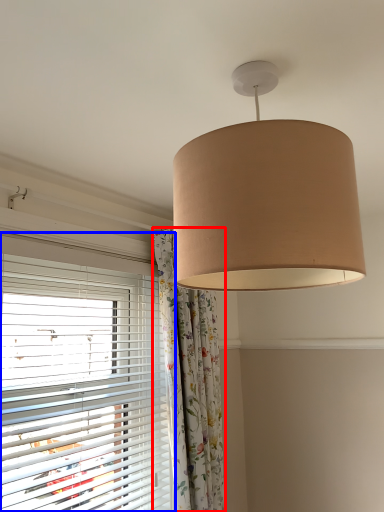
Question: Among these objects, which one is farthest to the camera, curtain (highlighted by a red box) or window blind (highlighted by a blue box)?

Choices:
 (A) curtain
 (B) window blind

Answer: (A)